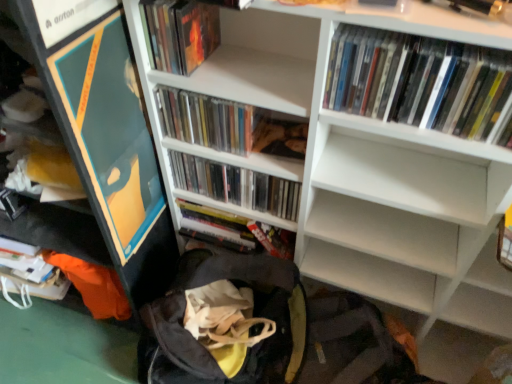
Question: From their relative heights in the image, would you say matte plastic books at center, which is counted as the fourth book, starting from the front, is taller or shorter than matte plastic book at upper left, which ranks as the 2th book in front-to-back order?

Choices:
 (A) tall
 (B) short

Answer: (A)

Question: From the image's perspective, relative to matte plastic book at upper left, marked as the fourth book in a back-to-front arrangement, is matte plastic books at center, which is counted as the fourth book, starting from the front, above or below?

Choices:
 (A) above
 (B) below

Answer: (B)

Question: Estimate the real-world distances between objects in this image. Which object is closer to the white matte bookcase at upper center?

Choices:
 (A) clear plastic cds at center, which is the 3th book from front to back
 (B) black fabric backpack at lower center
 (C) silver metallic book at center, which is the first book in back-to-front order
 (D) white glossy dvds at upper right, the first book from the front
 (E) matte plastic book at upper left, marked as the fourth book in a back-to-front arrangement

Answer: (A)

Question: Based on their relative distances, which object is nearer to the silver metallic book at center, which is the first book in back-to-front order?

Choices:
 (A) white matte bookcase at upper center
 (B) black fabric backpack at lower center
 (C) white glossy dvds at upper right, the first book from the front
 (D) matte plastic books at center, marked as the second book in a back-to-front arrangement
 (E) matte plastic book at upper left, which ranks as the 2th book in front-to-back order

Answer: (D)